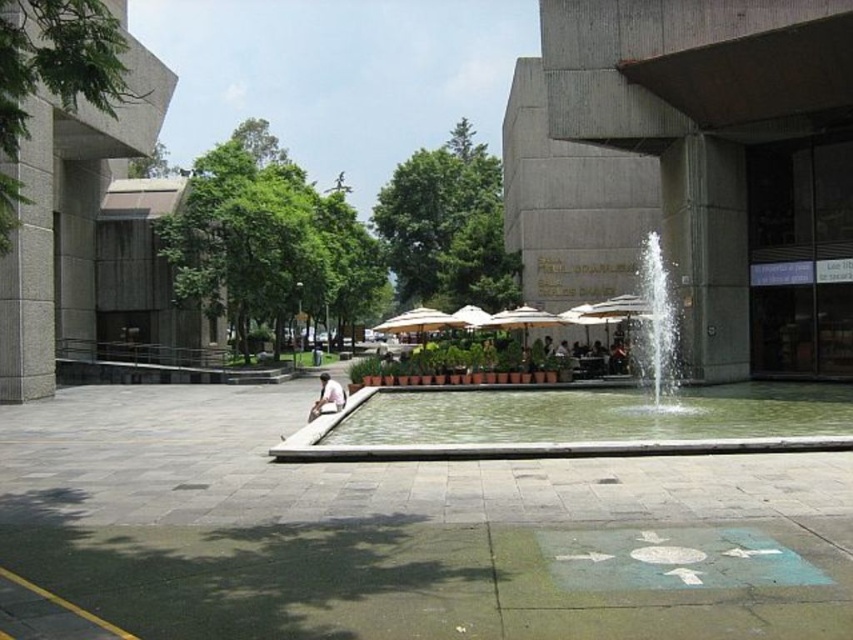
Question: Is green concrete fountain at center thinner than green concrete water at center?

Choices:
 (A) yes
 (B) no

Answer: (B)

Question: Does green concrete fountain at center have a larger size compared to green concrete water at center?

Choices:
 (A) yes
 (B) no

Answer: (A)

Question: Does green concrete fountain at center have a smaller size compared to green concrete water at center?

Choices:
 (A) no
 (B) yes

Answer: (A)

Question: Which object appears closest to the camera in this image?

Choices:
 (A) green concrete water at center
 (B) green concrete fountain at center

Answer: (A)